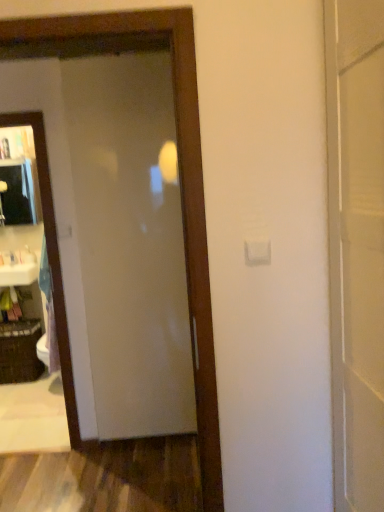
Identify the location of white plastic bag at left. (27, 255).

The width and height of the screenshot is (384, 512). What do you see at coordinates (27, 255) in the screenshot?
I see `white plastic bag at left` at bounding box center [27, 255].

In order to face black woven basket at lower left, should I rotate leftwards or rightwards?

To face it directly, rotate left by 22.395 degrees.

Where is `clear glass mirror at left`? clear glass mirror at left is located at coordinates (x=52, y=261).

What do you see at coordinates (130, 243) in the screenshot?
I see `matte glass door at center` at bounding box center [130, 243].

You are a GUI agent. You are given a task and a screenshot of the screen. Output one action in this format:
    pyautogui.click(x=<x>, y=<y>)
    Task: Click on the white glossy sink at left
    The width and height of the screenshot is (384, 512).
    Given the screenshot: What is the action you would take?
    pyautogui.click(x=19, y=268)

Where is `toiletry above the white glossy sink at left (from a real-world perspective)`? This screenshot has width=384, height=512. toiletry above the white glossy sink at left (from a real-world perspective) is located at coordinates (27, 255).

Is point (29, 259) in front of point (8, 272)?

No, it is not.

Can you tell me how much white plastic bag at left and white glossy sink at left differ in facing direction?

They differ by 0.00192 degrees in their facing directions.

In the scene shown: From the image's perspective, which one is positioned lower, white plastic bag at left or white glossy sink at left?

white glossy sink at left, from the image's perspective.

From the picture: From the image's perspective, between black woven basket at lower left and matte glass door at center, who is located below?

black woven basket at lower left appears lower in the image.

Between black woven basket at lower left and matte glass door at center, which one has less height?

black woven basket at lower left is shorter.

Could you tell me if black woven basket at lower left is turned towards matte glass door at center?

No, black woven basket at lower left is not oriented towards matte glass door at center.

Looking at this image, from a real-world perspective, which object rests below the other?

black woven basket at lower left is physically lower.

Is black woven basket at lower left completely or partially inside matte black medicine cabinet at left?

Actually, black woven basket at lower left is outside matte black medicine cabinet at left.

From the picture: Considering the relative positions of matte black medicine cabinet at left and black woven basket at lower left in the image provided, is matte black medicine cabinet at left in front of black woven basket at lower left?

No, the depth of matte black medicine cabinet at left is greater than that of black woven basket at lower left.

From a real-world perspective, is matte black medicine cabinet at left above or below black woven basket at lower left?

matte black medicine cabinet at left is situated higher than black woven basket at lower left in the real world.

Is matte black medicine cabinet at left facing towards black woven basket at lower left?

No, matte black medicine cabinet at left is not facing towards black woven basket at lower left.

Are matte black medicine cabinet at left and clear glass mirror at left beside each other?

No, matte black medicine cabinet at left is not making contact with clear glass mirror at left.

Can you confirm if matte black medicine cabinet at left is positioned to the right of clear glass mirror at left?

In fact, matte black medicine cabinet at left is to the left of clear glass mirror at left.

Between matte black medicine cabinet at left and clear glass mirror at left, which one has smaller width?

matte black medicine cabinet at left is thinner.

From a real-world perspective, is matte black medicine cabinet at left positioned over clear glass mirror at left based on gravity?

Correct, in the physical world, matte black medicine cabinet at left is higher than clear glass mirror at left.

Is point (17, 223) closer or farther from the camera than point (148, 144)?

Clearly, point (17, 223) is more distant from the camera than point (148, 144).

Considering the sizes of matte black medicine cabinet at left and matte glass door at center in the image, is matte black medicine cabinet at left wider or thinner than matte glass door at center?

Clearly, matte black medicine cabinet at left has more width compared to matte glass door at center.

From a real-world perspective, relative to matte glass door at center, is matte black medicine cabinet at left vertically above or below?

Clearly, from a real-world perspective, matte black medicine cabinet at left is above matte glass door at center.

Is black woven basket at lower left placed right next to clear glass mirror at left?

black woven basket at lower left and clear glass mirror at left are not in contact.

Is black woven basket at lower left facing towards clear glass mirror at left?

No, black woven basket at lower left is not facing towards clear glass mirror at left.

From a real-world perspective, which is physically below, black woven basket at lower left or clear glass mirror at left?

In real-world perspective, black woven basket at lower left is lower.

Is point (6, 328) behind point (36, 112)?

Yes, point (6, 328) is behind point (36, 112).

Can you see clear glass mirror at left touching white glossy sink at left?

They are not placed beside each other.

From a real-world perspective, is clear glass mirror at left physically above white glossy sink at left?

Yes, from a real-world perspective, clear glass mirror at left is on top of white glossy sink at left.

Is clear glass mirror at left positioned with its back to white glossy sink at left?

clear glass mirror at left is not turned away from white glossy sink at left.

The width and height of the screenshot is (384, 512). In order to click on toiletry that is above the white glossy sink at left (from the image's perspective) in this screenshot , I will do `click(27, 255)`.

The height and width of the screenshot is (512, 384). Identify the location of door that is above the black woven basket at lower left (from a real-world perspective). (130, 243).

When comparing their distances from white plastic bag at left, does black woven basket at lower left or matte glass door at center seem closer?

black woven basket at lower left is positioned closer to the anchor white plastic bag at left.

Looking at the image, which one is located closer to white glossy sink at left, matte black medicine cabinet at left or black woven basket at lower left?

The object closer to white glossy sink at left is black woven basket at lower left.

From the image, which object appears to be nearer to black woven basket at lower left, white glossy sink at left or white plastic bag at left?

white glossy sink at left lies closer to black woven basket at lower left than the other object.

Considering their positions, is matte glass door at center positioned further to black woven basket at lower left than clear glass mirror at left?

matte glass door at center.

Considering their positions, is matte black medicine cabinet at left positioned further to clear glass mirror at left than white glossy sink at left?

The object further to clear glass mirror at left is matte black medicine cabinet at left.

Based on their spatial positions, is black woven basket at lower left or clear glass mirror at left further from matte black medicine cabinet at left?

clear glass mirror at left is further to matte black medicine cabinet at left.

Considering their positions, is matte glass door at center positioned closer to matte black medicine cabinet at left than clear glass mirror at left?

Based on the image, clear glass mirror at left appears to be nearer to matte black medicine cabinet at left.

Considering their positions, is clear glass mirror at left positioned further to white glossy sink at left than matte black medicine cabinet at left?

clear glass mirror at left lies further to white glossy sink at left than the other object.

Where is `cabinetry between matte glass door at center and matte black medicine cabinet at left from front to back`? cabinetry between matte glass door at center and matte black medicine cabinet at left from front to back is located at coordinates (22, 340).

At what (x,y) coordinates should I click in order to perform the action: click on sink located between matte glass door at center and white plastic bag at left in the depth direction. Please return your answer as a coordinate pair (x, y). The width and height of the screenshot is (384, 512). Looking at the image, I should click on (19, 268).

Identify the location of sink between clear glass mirror at left and white plastic bag at left along the z-axis. (19, 268).

Identify the location of cabinetry between clear glass mirror at left and white plastic bag at left from front to back. (22, 340).